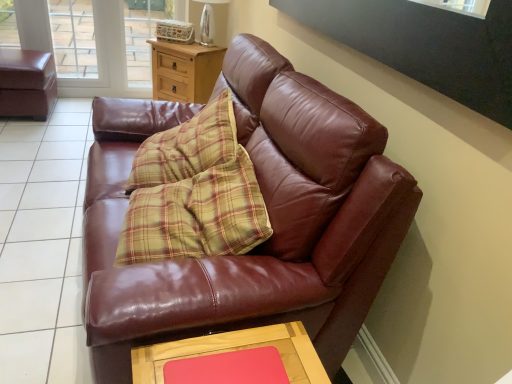
Describe the element at coordinates (233, 358) in the screenshot. I see `wooden table at lower center` at that location.

At what (x,y) coordinates should I click in order to perform the action: click on rubberized pink mat at lower center. Please return your answer as a coordinate pair (x, y). Looking at the image, I should click on (229, 368).

The width and height of the screenshot is (512, 384). Describe the element at coordinates (196, 215) in the screenshot. I see `yellow plaid pillow at center` at that location.

Measure the distance between yellow plaid pillow at center and camera.

The distance of yellow plaid pillow at center from camera is 1.22 meters.

What do you see at coordinates (210, 21) in the screenshot? This screenshot has height=384, width=512. I see `clear glass lamp at upper center` at bounding box center [210, 21].

The image size is (512, 384). Find the location of `clear glass lamp at upper center`. clear glass lamp at upper center is located at coordinates (210, 21).

Describe the element at coordinates (73, 38) in the screenshot. I see `transparent glass window at upper left` at that location.

The height and width of the screenshot is (384, 512). Find the location of `wooden table at lower center`. wooden table at lower center is located at coordinates (233, 358).

Is woodenside table at upper center taller than transparent glass screen door at upper left?

In fact, woodenside table at upper center may be shorter than transparent glass screen door at upper left.

Is transparent glass screen door at upper left at the back of woodenside table at upper center?

No.

Is woodenside table at upper center to the right of transparent glass screen door at upper left from the viewer's perspective?

Indeed, woodenside table at upper center is positioned on the right side of transparent glass screen door at upper left.

Relative to transparent glass screen door at upper left, is woodenside table at upper center in front or behind?

Clearly, woodenside table at upper center is in front of transparent glass screen door at upper left.

Is point (141, 33) less distant than point (177, 291)?

No, it is behind (177, 291).

In the scene shown: Is the position of transparent glass screen door at upper left more distant than that of shiny brown leather couch at center?

Yes, transparent glass screen door at upper left is behind shiny brown leather couch at center.

Which is more to the left, transparent glass screen door at upper left or shiny brown leather couch at center?

Positioned to the left is transparent glass screen door at upper left.

From a real-world perspective, between rubberized pink mat at lower center and woodenside table at upper center, who is vertically lower?

woodenside table at upper center, from a real-world perspective.

From the image's perspective, is rubberized pink mat at lower center below woodenside table at upper center?

Yes.

What are the coordinates of `flat above the woodenside table at upper center (from a real-world perspective)` in the screenshot? It's located at (229, 368).

Is shiny brown leather couch at center closer to camera compared to wooden table at lower center?

Yes, shiny brown leather couch at center is closer to the viewer.

Is shiny brown leather couch at center at the right side of wooden table at lower center?

No, shiny brown leather couch at center is not to the right of wooden table at lower center.

How many degrees apart are the facing directions of shiny brown leather couch at center and wooden table at lower center?

They differ by 0.000595 degrees in their facing directions.

Can you confirm if shiny brown leather couch at center is taller than wooden table at lower center?

Yes, shiny brown leather couch at center is taller than wooden table at lower center.

In terms of size, does yellow plaid pillow at center appear bigger or smaller than transparent glass screen door at upper left?

Considering their sizes, yellow plaid pillow at center takes up more space than transparent glass screen door at upper left.

Considering the sizes of objects yellow plaid pillow at center and transparent glass screen door at upper left in the image provided, who is taller, yellow plaid pillow at center or transparent glass screen door at upper left?

Standing taller between the two is transparent glass screen door at upper left.

Between yellow plaid pillow at center and transparent glass screen door at upper left, which one has larger width?

yellow plaid pillow at center.

Is yellow plaid pillow at center next to transparent glass screen door at upper left?

No, yellow plaid pillow at center is not beside transparent glass screen door at upper left.

Is leather swivel chair at left directly adjacent to shiny brown leather couch at center?

No, leather swivel chair at left is not touching shiny brown leather couch at center.

From the image's perspective, who appears lower, leather swivel chair at left or shiny brown leather couch at center?

shiny brown leather couch at center.

Is leather swivel chair at left looking in the opposite direction of shiny brown leather couch at center?

That's not correct — leather swivel chair at left is not looking away from shiny brown leather couch at center.

Is transparent glass screen door at upper left completely or partially inside clear glass lamp at upper center?

No, transparent glass screen door at upper left is not a part of clear glass lamp at upper center.

Is clear glass lamp at upper center far away from transparent glass screen door at upper left?

Actually, clear glass lamp at upper center and transparent glass screen door at upper left are a little close together.

Based on their positions, is clear glass lamp at upper center located to the left or right of transparent glass screen door at upper left?

Based on their positions, clear glass lamp at upper center is located to the right of transparent glass screen door at upper left.

This screenshot has width=512, height=384. I want to click on screen door on the left of the woodenside table at upper center, so point(146,34).

Where is `studio couch to the right of transparent glass screen door at upper left`? studio couch to the right of transparent glass screen door at upper left is located at coordinates (269, 215).

Which object lies further to the anchor point shiny brown leather couch at center, leather swivel chair at left or woodenside table at upper center?

leather swivel chair at left is further to shiny brown leather couch at center.

Looking at the image, which one is located closer to woodenside table at upper center, clear glass lamp at upper center or leather swivel chair at left?

Among the two, clear glass lamp at upper center is located nearer to woodenside table at upper center.

Which object lies nearer to the anchor point rubberized pink mat at lower center, wooden table at lower center or woodenside table at upper center?

Among the two, wooden table at lower center is located nearer to rubberized pink mat at lower center.

Looking at the image, which one is located closer to yellow plaid pillow at center, leather swivel chair at left or rubberized pink mat at lower center?

Among the two, rubberized pink mat at lower center is located nearer to yellow plaid pillow at center.

From the image, which object appears to be nearer to transparent glass window at upper left, rubberized pink mat at lower center or yellow plaid pillow at center?

yellow plaid pillow at center.

Which object lies further to the anchor point transparent glass window at upper left, rubberized pink mat at lower center or leather swivel chair at left?

Among the two, rubberized pink mat at lower center is located further to transparent glass window at upper left.

Looking at the image, which one is located closer to rubberized pink mat at lower center, leather swivel chair at left or transparent glass screen door at upper left?

leather swivel chair at left is closer to rubberized pink mat at lower center.

From the image, which object appears to be nearer to leather swivel chair at left, transparent glass window at upper left or wooden table at lower center?

Based on the image, transparent glass window at upper left appears to be nearer to leather swivel chair at left.

The height and width of the screenshot is (384, 512). I want to click on lamp between yellow plaid pillow at center and woodenside table at upper center from front to back, so click(210, 21).

You are a GUI agent. You are given a task and a screenshot of the screen. Output one action in this format:
    pyautogui.click(x=<x>, y=<y>)
    Task: Click on the lamp between wooden table at lower center and leather swivel chair at left along the z-axis
    Image resolution: width=512 pixels, height=384 pixels.
    Given the screenshot: What is the action you would take?
    pyautogui.click(x=210, y=21)

Locate an element on the screen. pillow between rubberized pink mat at lower center and clear glass lamp at upper center from front to back is located at coordinates (196, 215).

This screenshot has width=512, height=384. Find the location of `pillow between wooden table at lower center and woodenside table at upper center in the front-back direction`. pillow between wooden table at lower center and woodenside table at upper center in the front-back direction is located at coordinates (196, 215).